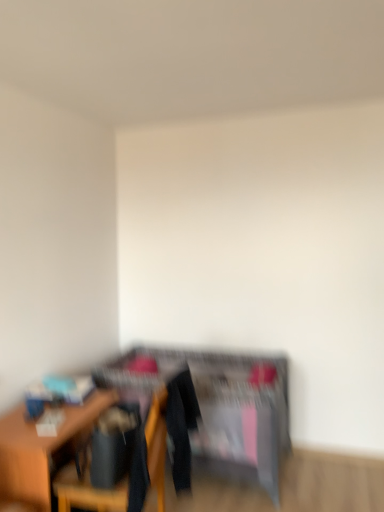
This screenshot has width=384, height=512. What do you see at coordinates (42, 450) in the screenshot?
I see `wooden table at left` at bounding box center [42, 450].

The height and width of the screenshot is (512, 384). What are the coordinates of `wooden table at left` in the screenshot? It's located at (42, 450).

Does wooden table at left contain wooden chair at lower left?

No.

Which of these two, wooden table at left or wooden chair at lower left, is smaller?

Smaller between the two is wooden chair at lower left.

Considering the points (2, 449) and (57, 486), which point is in front, point (2, 449) or point (57, 486)?

The point (2, 449) is more forward.

Could you tell me if wooden table at left is turned towards wooden chair at lower left?

Yes, wooden table at left faces towards wooden chair at lower left.

Which object is further away from the camera, wooden chair at lower left or wooden table at left?

wooden table at left is behind.

Are wooden chair at lower left and wooden table at left located far from each other?

No, there isn't a large distance between wooden chair at lower left and wooden table at left.

Is wooden chair at lower left aimed at wooden table at left?

Yes, wooden chair at lower left is oriented towards wooden table at left.

From a real-world perspective, between wooden chair at lower left and wooden table at left, who is vertically lower?

wooden table at left.

Measure the distance between wooden dresser at center and wooden table at left.

wooden dresser at center and wooden table at left are 31.28 inches apart from each other.

Relative to wooden table at left, is wooden dresser at center in front or behind?

Visually, wooden dresser at center is located behind wooden table at left.

Is wooden dresser at center oriented towards wooden table at left?

Yes, wooden dresser at center faces towards wooden table at left.

From a real-world perspective, is wooden dresser at center positioned over wooden table at left based on gravity?

Yes, from a real-world perspective, wooden dresser at center is above wooden table at left.

Is wooden dresser at center to the right of wooden chair at lower left from the viewer's perspective?

Yes, wooden dresser at center is to the right of wooden chair at lower left.

Measure the distance between wooden dresser at center and wooden chair at lower left.

wooden dresser at center is 34.52 inches away from wooden chair at lower left.

Is wooden dresser at center positioned with its back to wooden chair at lower left?

That's not correct — wooden dresser at center is not looking away from wooden chair at lower left.

Who is smaller, wooden dresser at center or wooden chair at lower left?

wooden chair at lower left.

Can you confirm if wooden chair at lower left is thinner than wooden dresser at center?

Indeed, wooden chair at lower left has a lesser width compared to wooden dresser at center.

Is wooden chair at lower left positioned with its back to wooden dresser at center?

No, wooden chair at lower left is not facing the opposite direction of wooden dresser at center.

In order to click on dresser behind the wooden chair at lower left in this screenshot , I will do `click(220, 407)`.

From a real-world perspective, is wooden chair at lower left below wooden dresser at center?

Actually, wooden chair at lower left is physically above wooden dresser at center in the real world.

Is wooden table at left facing away from wooden dresser at center?

wooden table at left is not turned away from wooden dresser at center.

From a real-world perspective, who is located lower, wooden table at left or wooden dresser at center?

From a 3D spatial view, wooden table at left is below.

The height and width of the screenshot is (512, 384). What are the coordinates of `dresser behind the wooden table at left` in the screenshot? It's located at (220, 407).

Can you confirm if wooden table at left is positioned to the left of wooden dresser at center?

Correct, you'll find wooden table at left to the left of wooden dresser at center.

You are a GUI agent. You are given a task and a screenshot of the screen. Output one action in this format:
    pyautogui.click(x=<x>, y=<y>)
    Task: Click on the chair on the right of wooden table at left
    The height and width of the screenshot is (512, 384).
    Given the screenshot: What is the action you would take?
    pyautogui.click(x=88, y=493)

The image size is (384, 512). In order to click on chair positioned vertically above the wooden table at left (from a real-world perspective) in this screenshot , I will do [x=88, y=493].

When comparing their distances from wooden table at left, does wooden chair at lower left or wooden dresser at center seem closer?

Based on the image, wooden chair at lower left appears to be nearer to wooden table at left.

Based on their spatial positions, is wooden table at left or wooden dresser at center further from wooden chair at lower left?

Based on the image, wooden dresser at center appears to be further to wooden chair at lower left.

From the image, which object appears to be farther from wooden chair at lower left, wooden dresser at center or wooden table at left?

Based on the image, wooden dresser at center appears to be further to wooden chair at lower left.

Considering their positions, is wooden table at left positioned closer to wooden dresser at center than wooden chair at lower left?

The object closer to wooden dresser at center is wooden table at left.

From the picture: Looking at the image, which one is located closer to wooden table at left, wooden dresser at center or wooden chair at lower left?

wooden chair at lower left.

From the picture: When comparing their distances from wooden dresser at center, does wooden chair at lower left or wooden table at left seem closer?

wooden table at left is positioned closer to the anchor wooden dresser at center.

Locate an element on the screen. chair between wooden table at left and wooden dresser at center from left to right is located at coordinates (88, 493).